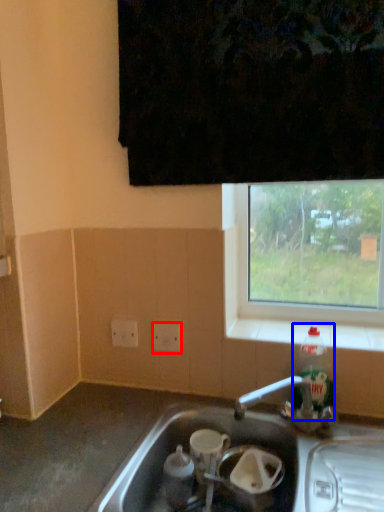
Question: Which object appears farthest to the camera in this image, electric outlet (highlighted by a red box) or bottle (highlighted by a blue box)?

Choices:
 (A) electric outlet
 (B) bottle

Answer: (A)